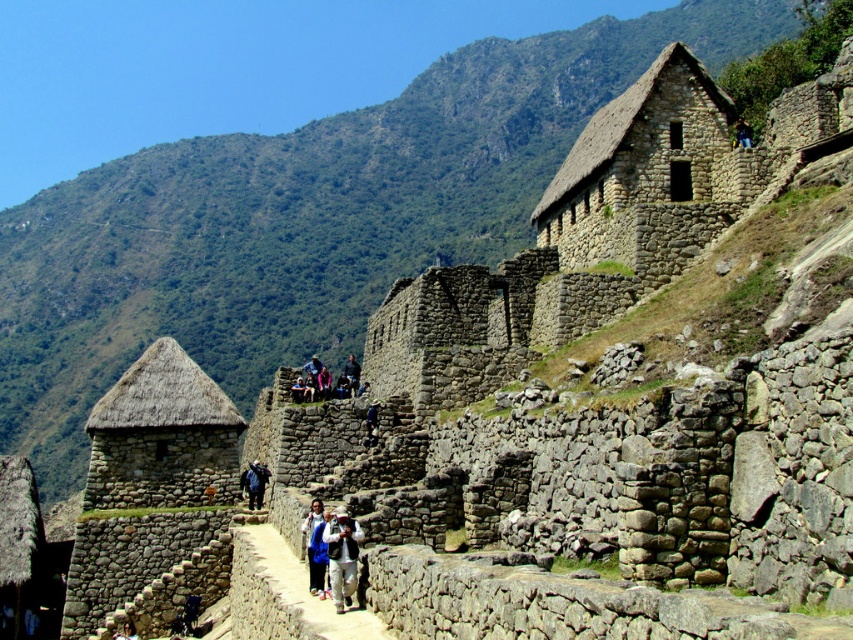
Does thatched stone hut at center-left have a lesser height compared to sandy stone path at center?

In fact, thatched stone hut at center-left may be taller than sandy stone path at center.

What do you see at coordinates (161, 435) in the screenshot?
I see `thatched stone hut at center-left` at bounding box center [161, 435].

This screenshot has height=640, width=853. I want to click on thatched stone hut at center-left, so click(x=161, y=435).

You are a GUI agent. You are given a task and a screenshot of the screen. Output one action in this format:
    pyautogui.click(x=<x>, y=<y>)
    Task: Click on the stone textured hut at upper right
    
    Given the screenshot: What is the action you would take?
    pyautogui.click(x=635, y=160)

In the scene shown: Between stone textured hut at upper right and sandy stone path at center, which one has less height?

With less height is sandy stone path at center.

At what (x,y) coordinates should I click in order to perform the action: click on stone textured hut at upper right. Please return your answer as a coordinate pair (x, y). This screenshot has width=853, height=640. Looking at the image, I should click on (635, 160).

This screenshot has height=640, width=853. What are the coordinates of `stone textured hut at upper right` in the screenshot? It's located at (635, 160).

Does point (334, 592) lie behind point (743, 134)?

That is False.

Can you confirm if white cotton jacket at center is smaller than dark blue fabric at upper right?

Yes.

What do you see at coordinates (341, 556) in the screenshot?
I see `white cotton jacket at center` at bounding box center [341, 556].

Find the location of a particular element. white cotton jacket at center is located at coordinates (341, 556).